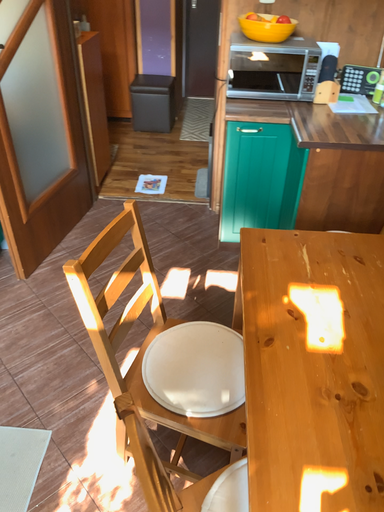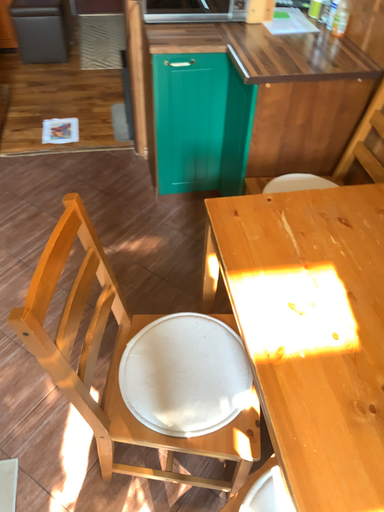
Question: Which way did the camera rotate in the video?

Choices:
 (A) rotated upward
 (B) rotated downward

Answer: (B)